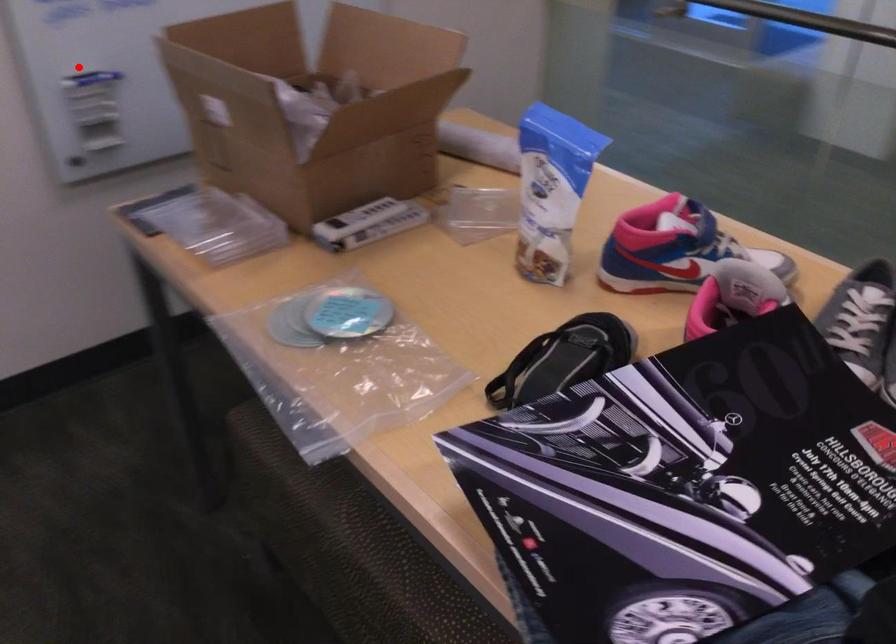
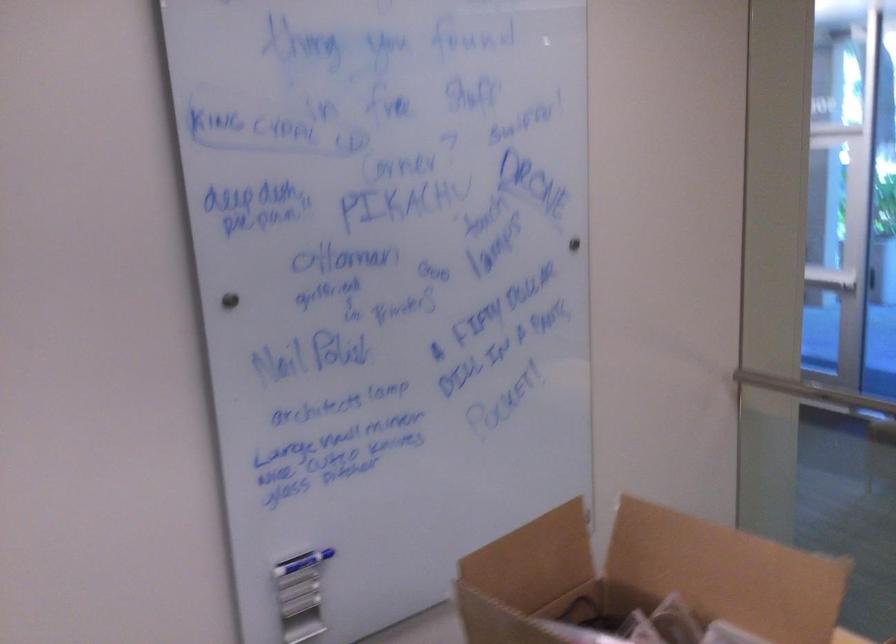
Question: I am providing you with two images of the same scene from different viewpoints. A red point is marked on the first image. At the location where the point appears in image 1, is it still visible in image 2?

Choices:
 (A) Yes
 (B) No

Answer: (A)